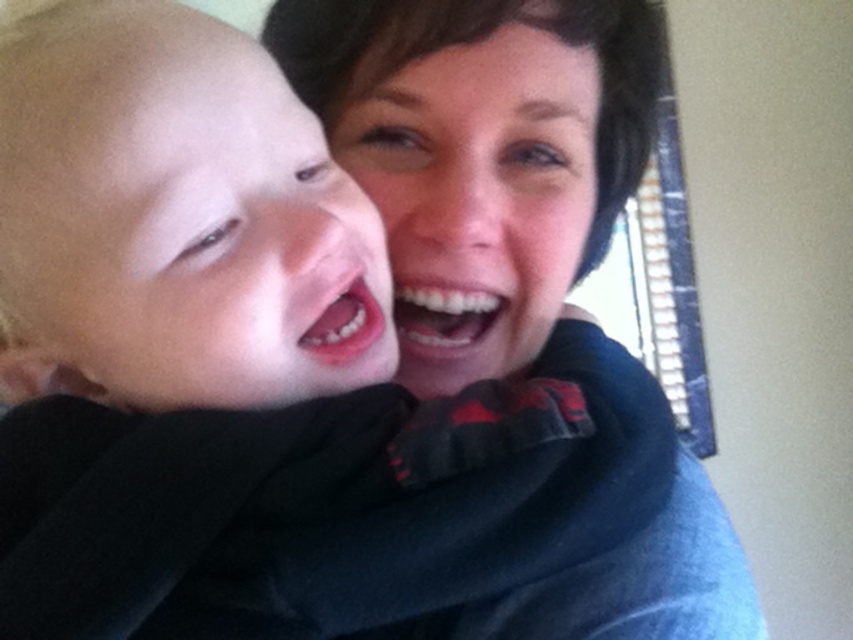
Which of these two, smooth skin baby at left or matte black scarf at center, stands shorter?

With less height is matte black scarf at center.

Which is behind, point (33, 72) or point (384, 220)?

The point (384, 220) is more distant.

Is point (105, 557) positioned behind point (432, 332)?

No, (105, 557) is in front of (432, 332).

Find the location of `smooth skin baby at left`. smooth skin baby at left is located at coordinates [x=169, y=308].

Does point (148, 248) lie in front of point (62, 236)?

Yes, it is in front of point (62, 236).

Can you confirm if smooth skin baby at left is shorter than smooth skin face at left?

No, smooth skin baby at left is not shorter than smooth skin face at left.

This screenshot has width=853, height=640. What are the coordinates of `smooth skin baby at left` in the screenshot? It's located at (169, 308).

Does smooth skin baby at left appear on the left side of matte black sweater at upper center?

Correct, you'll find smooth skin baby at left to the left of matte black sweater at upper center.

Between point (370, 364) and point (579, 276), which one is positioned in front?

Point (370, 364)

The height and width of the screenshot is (640, 853). In order to click on smooth skin baby at left in this screenshot , I will do `click(169, 308)`.